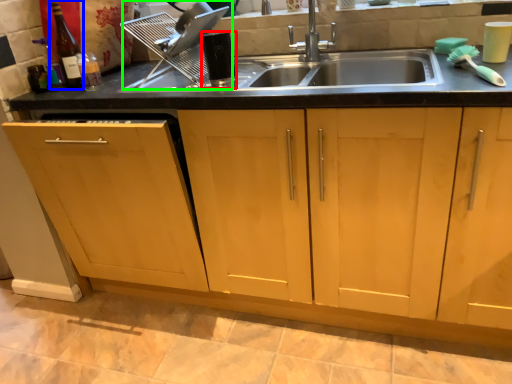
Question: Estimate the real-world distances between objects in this image. Which object is farther from appliance (highlighted by a red box), bottle (highlighted by a blue box) or appliance (highlighted by a green box)?

Choices:
 (A) bottle
 (B) appliance

Answer: (A)